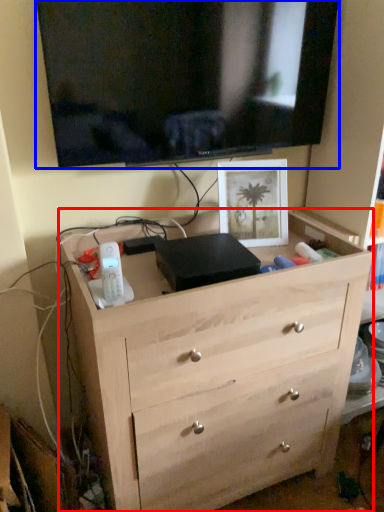
Question: Among these objects, which one is farthest to the camera, chest of drawers (highlighted by a red box) or television (highlighted by a blue box)?

Choices:
 (A) chest of drawers
 (B) television

Answer: (B)